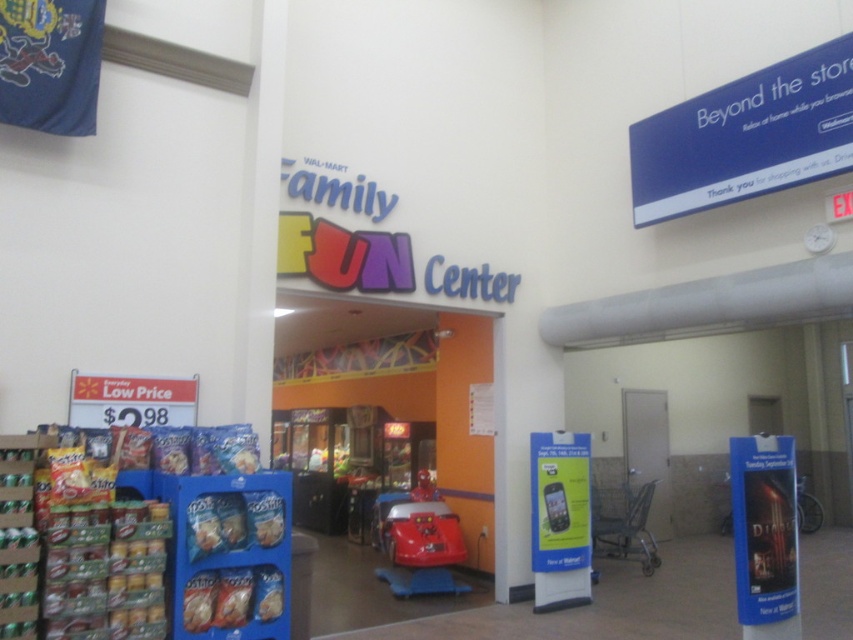
Question: Is blue plastic sign at upper right closer to camera compared to shiny red car at center?

Choices:
 (A) no
 (B) yes

Answer: (B)

Question: Which point appears closest to the camera in this image?

Choices:
 (A) (730, 113)
 (B) (747, 534)
 (C) (561, 508)
 (D) (387, 547)

Answer: (B)

Question: Which of the following is the farthest from the observer?

Choices:
 (A) click(x=735, y=593)
 (B) click(x=444, y=516)
 (C) click(x=544, y=480)

Answer: (B)

Question: Is blue plastic sign at upper right positioned in front of black glossy poster at lower right?

Choices:
 (A) no
 (B) yes

Answer: (A)

Question: Among these points, which one is nearest to the camera?

Choices:
 (A) (683, 161)
 (B) (772, 515)
 (C) (538, 504)

Answer: (B)

Question: Is blue plastic sign at upper right bigger than black glossy poster at lower right?

Choices:
 (A) yes
 (B) no

Answer: (A)